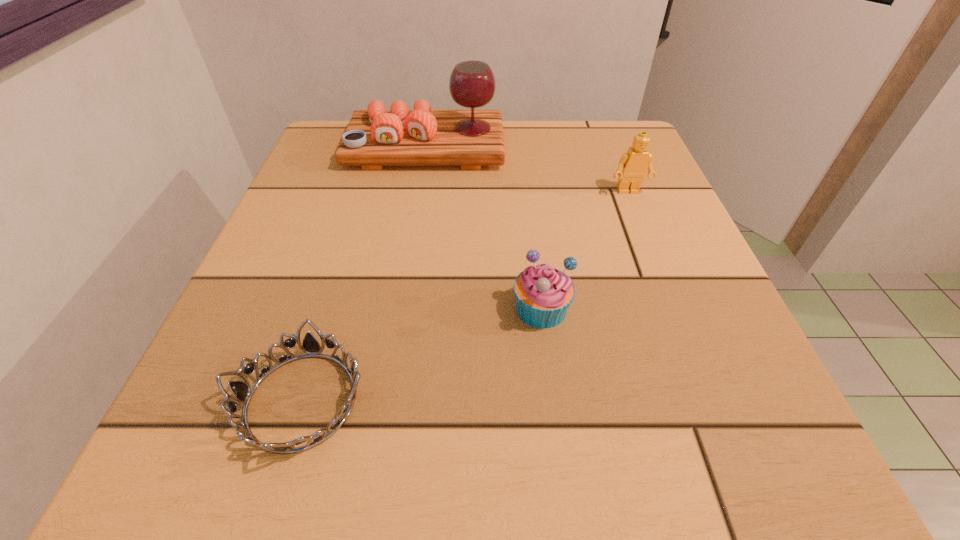
At what (x,y) coordinates should I click in order to perform the action: click on vacant space at the near edge of the desktop. Please return your answer as a coordinate pair (x, y). This screenshot has height=540, width=960. Looking at the image, I should click on (463, 477).

I want to click on free region at the left edge of the desktop, so click(203, 372).

Where is `free space at the right edge of the desktop`? This screenshot has width=960, height=540. free space at the right edge of the desktop is located at coordinates (596, 217).

In the image, there is a desktop. Where is `free space at the far right corner`? This screenshot has width=960, height=540. free space at the far right corner is located at coordinates (608, 145).

Identify the location of vacant point located between the second tallest object and the tallest object. The width and height of the screenshot is (960, 540). (527, 170).

Where is `free spot between the third farthest object and the nearest object`? The image size is (960, 540). free spot between the third farthest object and the nearest object is located at coordinates (421, 354).

Locate an element on the screen. The height and width of the screenshot is (540, 960). free area in between the platter and the Lego is located at coordinates pos(527,170).

Locate an element on the screen. The height and width of the screenshot is (540, 960). vacant space that's between the third farthest object and the rightmost object is located at coordinates (585, 250).

Locate an element on the screen. This screenshot has width=960, height=540. free area in between the second nearest object and the tiara is located at coordinates (421, 354).

Find the location of a particular element. vacant area that lies between the tiara and the muffin is located at coordinates (421, 354).